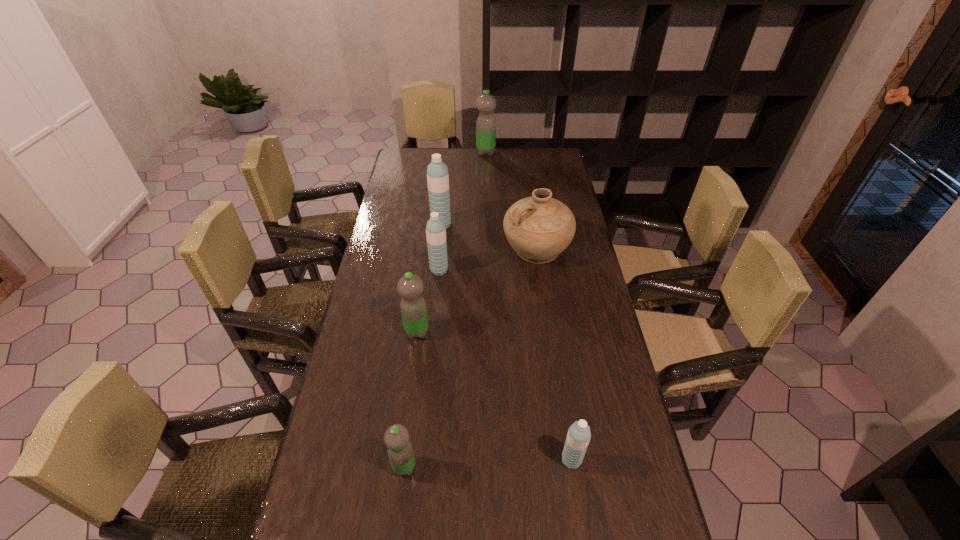
Find the location of `green water bottle identified as the closest to the smallest blue water bottle`. green water bottle identified as the closest to the smallest blue water bottle is located at coordinates (396, 438).

Identify the location of green water bottle object that ranks as the third closest to the pottery. The width and height of the screenshot is (960, 540). (396, 438).

Locate which blue water bottle is the closest to the pottery. Please provide its 2D coordinates. Your answer should be formatted as a tuple, i.e. [(x, y)], where the tuple contains the x and y coordinates of a point satisfying the conditions above.

[(435, 229)]

Choose which blue water bottle is the nearest neighbor to the third nearest water bottle. Please provide its 2D coordinates. Your answer should be formatted as a tuple, i.e. [(x, y)], where the tuple contains the x and y coordinates of a point satisfying the conditions above.

[(435, 229)]

What are the coordinates of `free space that satisfies the following two spatial constraints: 1. on the front side of the pottery; 2. on the left side of the smallest blue water bottle` in the screenshot? It's located at (566, 461).